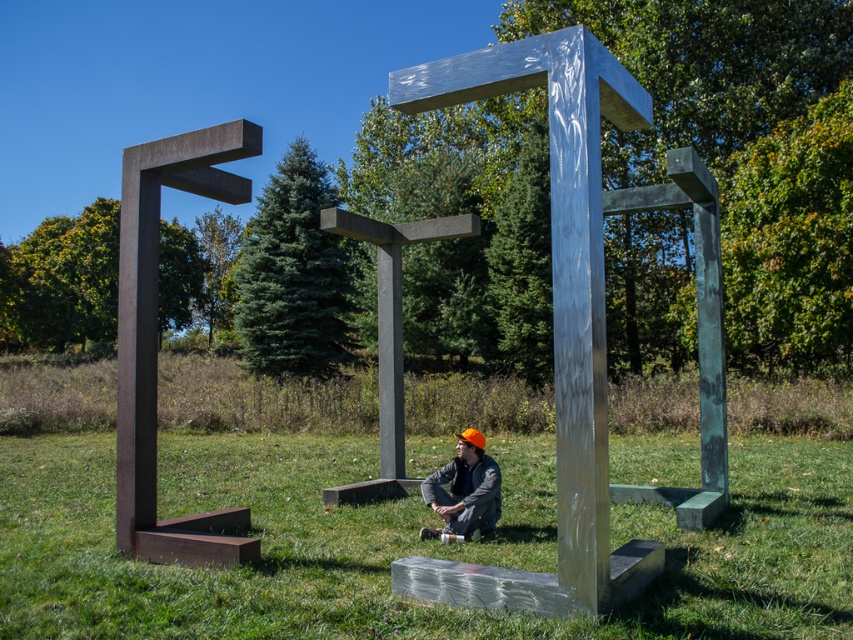
Does green grass at center appear over matte orange helmet at center?

No.

Does green grass at center have a lesser height compared to matte orange helmet at center?

Yes.

Is point (686, 467) less distant than point (447, 481)?

That is False.

The image size is (853, 640). I want to click on green grass at center, so click(405, 545).